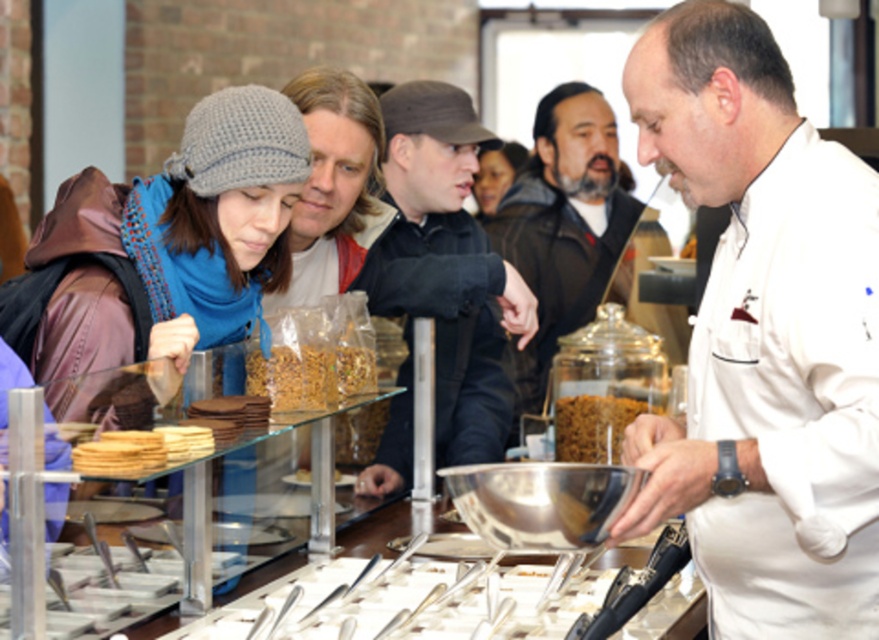
Between black matte jacket at center and brown crunchy granola at center, which one has less height?

With less height is brown crunchy granola at center.

Does point (481, 317) lie in front of point (609, 458)?

No, (481, 317) is further to viewer.

Locate an element on the screen. The height and width of the screenshot is (640, 879). black matte jacket at center is located at coordinates point(453,259).

Is knitted gray hat at left wider than brown matte cookies at lower left?

Indeed, knitted gray hat at left has a greater width compared to brown matte cookies at lower left.

At what (x,y) coordinates should I click in order to perform the action: click on knitted gray hat at left. Please return your answer as a coordinate pair (x, y). The width and height of the screenshot is (879, 640). Looking at the image, I should click on (164, 244).

The width and height of the screenshot is (879, 640). What are the coordinates of `knitted gray hat at left` in the screenshot? It's located at (164, 244).

Is translucent plastic bag of nuts at center bigger than brown matte cookies at lower left?

Indeed, translucent plastic bag of nuts at center has a larger size compared to brown matte cookies at lower left.

Who is more distant from viewer, [306,401] or [211,416]?

The point [306,401] is behind.

Is point (299, 372) closer to viewer compared to point (249, 426)?

No, (299, 372) is further to viewer.

The image size is (879, 640). What are the coordinates of `translucent plastic bag of nuts at center` in the screenshot? It's located at (309, 374).